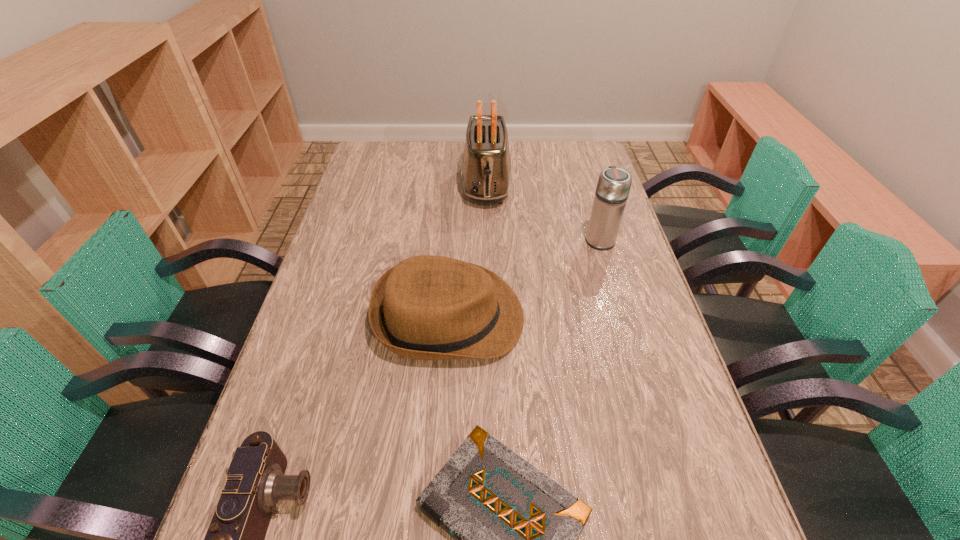
You are a GUI agent. You are given a task and a screenshot of the screen. Output one action in this format:
    pyautogui.click(x=<x>, y=<y>)
    Task: Click on the vacant space located on the front-facing side of the third farthest object
    The width and height of the screenshot is (960, 540).
    Given the screenshot: What is the action you would take?
    pyautogui.click(x=632, y=317)

Image resolution: width=960 pixels, height=540 pixels. I want to click on object present at the far edge, so click(x=486, y=173).

Find the location of a particular element. object present at the right edge is located at coordinates (613, 187).

The width and height of the screenshot is (960, 540). In the image, there is a desktop. Identify the location of vacant space at the far edge. (445, 163).

The width and height of the screenshot is (960, 540). In the image, there is a desktop. Find the location of `free space at the left edge`. free space at the left edge is located at coordinates (370, 179).

This screenshot has height=540, width=960. In order to click on vacant space at the right edge in this screenshot , I will do `click(687, 406)`.

I want to click on vacant space at the far left corner of the desktop, so click(x=398, y=167).

This screenshot has height=540, width=960. Find the location of `free spot between the tallest object and the third nearest object`. free spot between the tallest object and the third nearest object is located at coordinates (468, 251).

Locate an element on the screen. free space between the thermos bottle and the fedora is located at coordinates (524, 278).

This screenshot has height=540, width=960. Find the location of `vacant space that's between the thermos bottle and the farthest object`. vacant space that's between the thermos bottle and the farthest object is located at coordinates (543, 212).